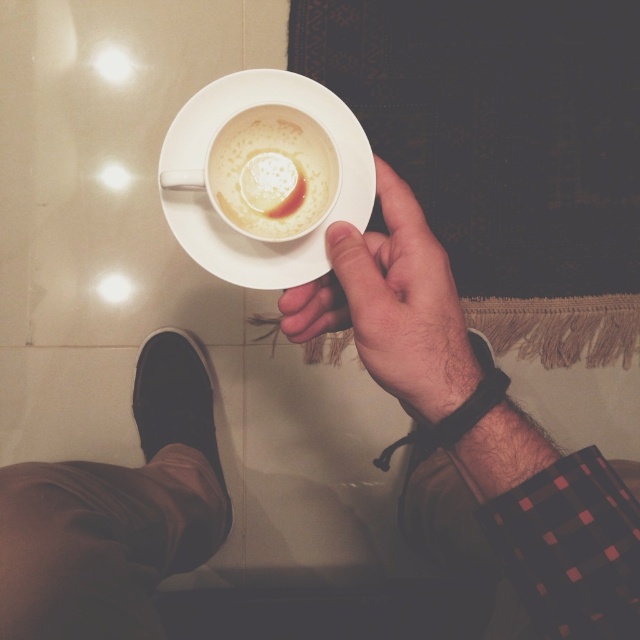
In the scene shown: You are trying to decide whether to place the white matte cup at center on top of the black suede shoe at lower left. Based on their sizes, would the cup fit stably on the shoe?

The white matte cup at center is not as tall as the black suede shoe at lower left, so the cup would likely be too short to sit stably on the shoe due to the height difference.

You are a barista preparing a latte. You have a white matte cup at center and a white matte saucer at center. Which item should you place the cup on to serve the drink properly?

You should place the white matte cup at center on the white matte saucer at center because the saucer has a greater height, providing a stable base for the cup.

Based on the photo, you are designing a storage box that needs to fit both the white matte cup at center and the black suede shoe at lower left. Based on their sizes, which object should be placed in the smaller compartment?

The white matte cup at center should be placed in the smaller compartment because it occupies less space than the black suede shoe at lower left.